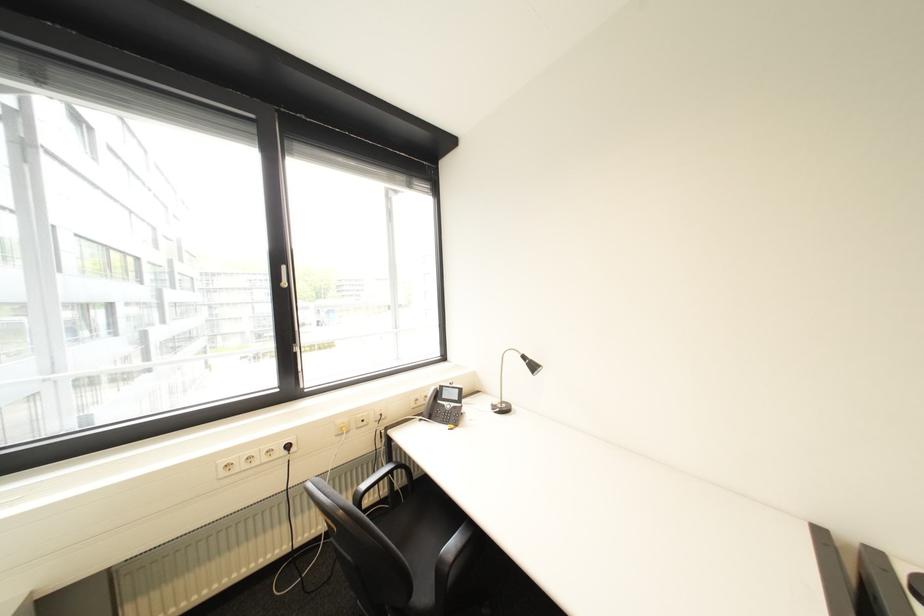
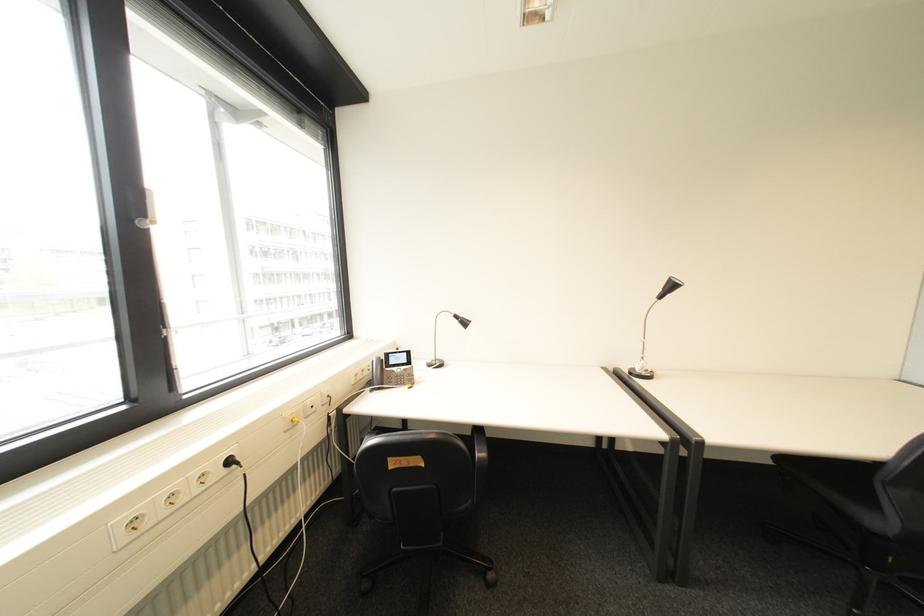
Find the pixel in the second image that matches pixel 298 447 in the first image.

(239, 463)